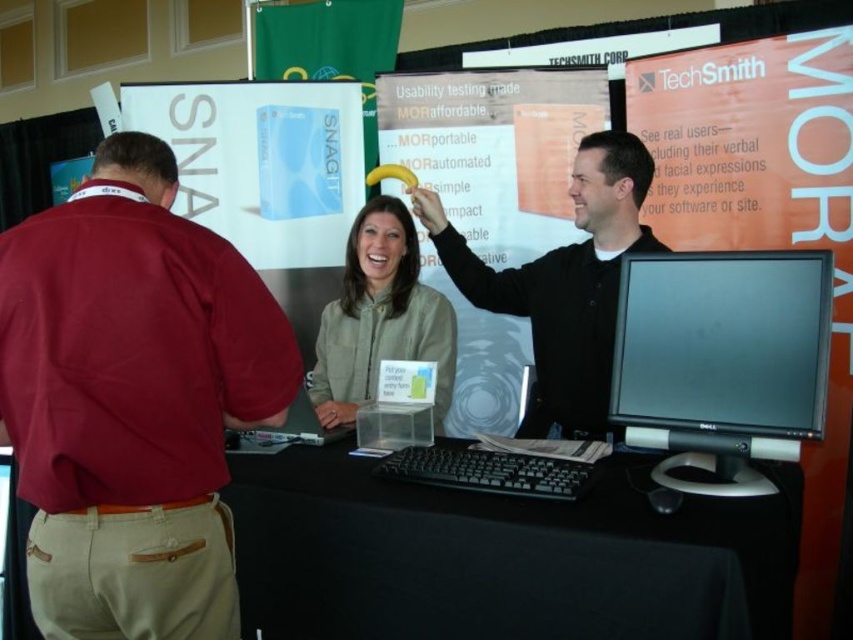
You are at a TechSmith exhibition booth and need to locate the maroon cotton shirt at left and the black matte computer mouse at upper center. From the perspective of someone standing at the booth counter, which object is positioned to the right?

The black matte computer mouse at upper center is positioned to the right of the maroon cotton shirt at left.

From the picture: You are a photographer at the TechSmith booth and need to position a 36 inch wide backdrop between the maroon cotton shirt at left and the black glossy monitor at center. Can you fit it without overlapping either object?

The distance between the maroon cotton shirt at left and the black glossy monitor at center is 34.83 inches. Since the backdrop is 36 inches wide, it cannot fit between them without overlapping either object.